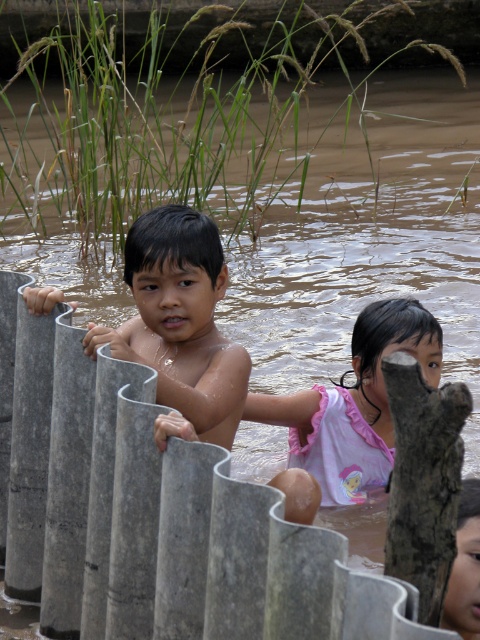
Is smooth skin boy at center taller than pink cotton shirt at center?

Indeed, smooth skin boy at center has a greater height compared to pink cotton shirt at center.

Which of these two, smooth skin boy at center or pink cotton shirt at center, stands shorter?

pink cotton shirt at center

The height and width of the screenshot is (640, 480). I want to click on smooth skin boy at center, so click(x=180, y=321).